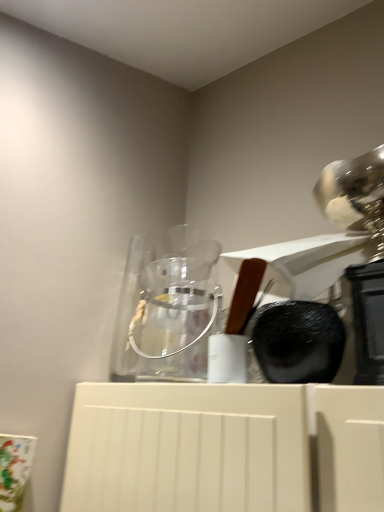
Image resolution: width=384 pixels, height=512 pixels. Describe the element at coordinates (175, 318) in the screenshot. I see `transparent glass jar at center` at that location.

You are a GUI agent. You are given a task and a screenshot of the screen. Output one action in this format:
    pyautogui.click(x=<x>, y=<y>)
    Task: Click on the transparent glass jar at center
    Image resolution: width=384 pixels, height=512 pixels.
    Given the screenshot: What is the action you would take?
    pyautogui.click(x=175, y=318)

You are a GUI agent. You are given a task and a screenshot of the screen. Output one action in this format:
    pyautogui.click(x=<x>, y=<y>)
    Task: Click on the transparent glass jar at center
    
    Given the screenshot: What is the action you would take?
    pyautogui.click(x=175, y=318)